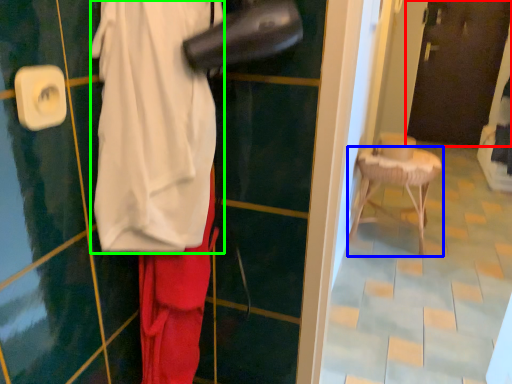
Question: Which object is positioned farthest from door (highlighted by a red box)? Select from furniture (highlighted by a blue box) and wide (highlighted by a green box).

Choices:
 (A) furniture
 (B) wide

Answer: (B)